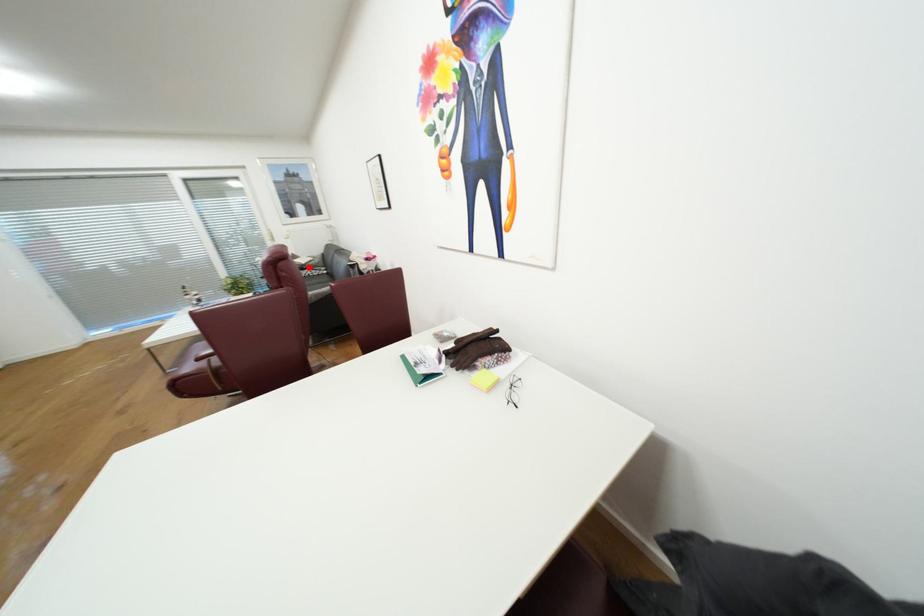
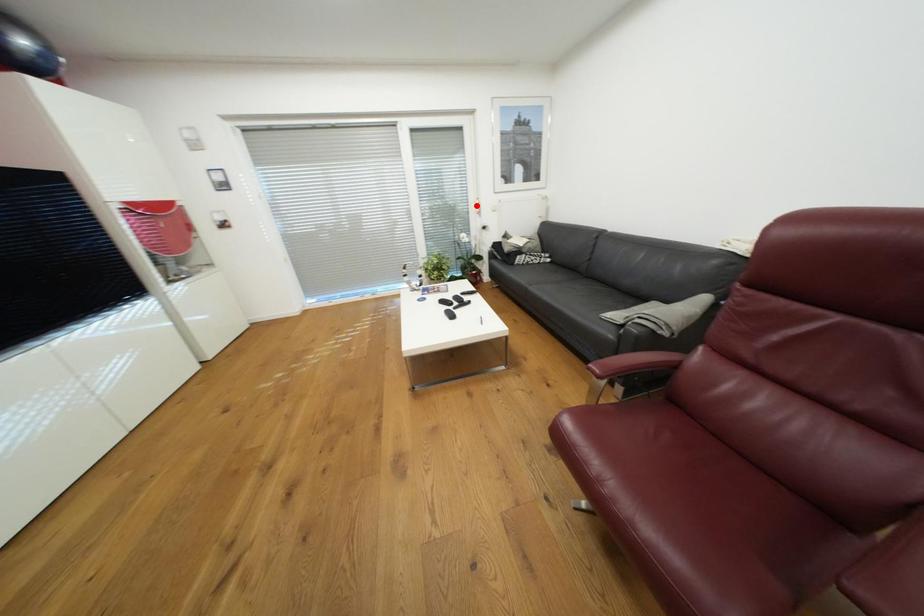
I am providing you with two images of the same scene from different viewpoints. A red point is marked on the first image and another point is marked on the second image. Do the highlighted points in image1 and image2 indicate the same real-world spot?

No